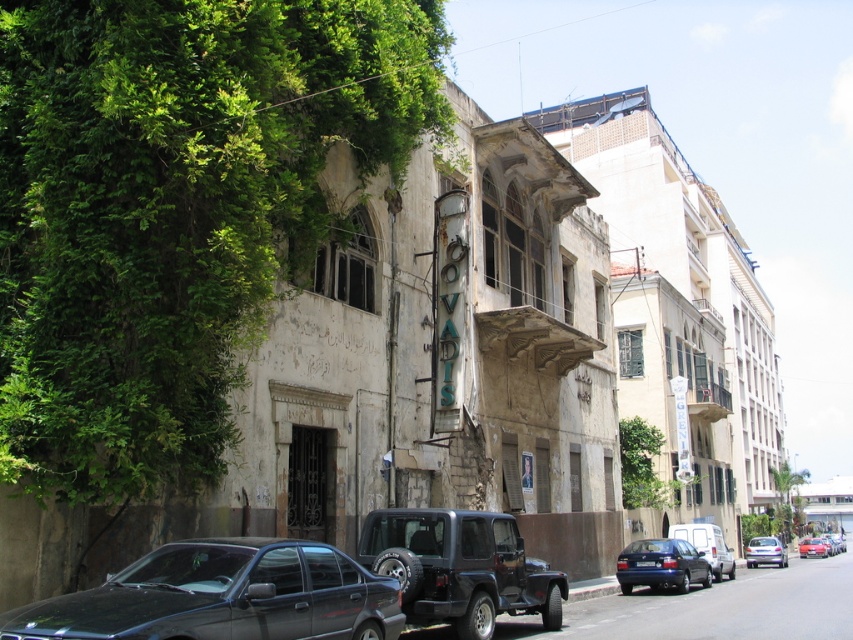
Question: Which point is farther to the camera?

Choices:
 (A) (637, 564)
 (B) (67, 225)
 (C) (780, 545)

Answer: (C)

Question: Where is shiny black sedan at lower left located in relation to purple glossy hatchback at lower right in the image?

Choices:
 (A) below
 (B) above

Answer: (B)

Question: Which of the following is the farthest from the observer?

Choices:
 (A) purple glossy hatchback at lower right
 (B) blue matte license plate at center

Answer: (A)

Question: Which point appears farthest from the camera in this image?

Choices:
 (A) (141, 497)
 (B) (813, 552)
 (C) (415, 529)

Answer: (B)

Question: Does green leafy vines at left have a greater width compared to matte blue sedan at lower right?

Choices:
 (A) yes
 (B) no

Answer: (A)

Question: Does purple glossy hatchback at lower right have a greater width compared to metallic red car at right?

Choices:
 (A) yes
 (B) no

Answer: (B)